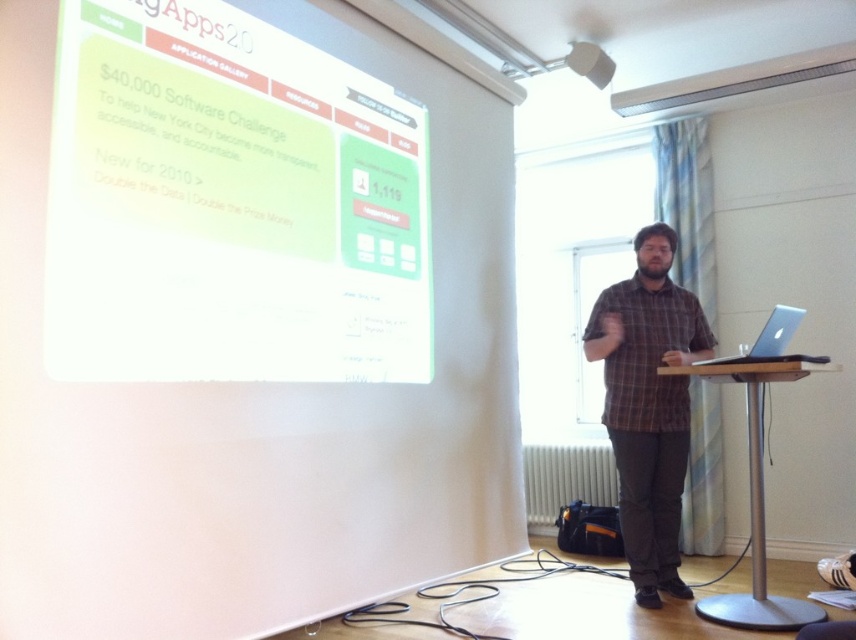
Question: Is white glossy projection screen at upper left wider than matte black shirt at center?

Choices:
 (A) yes
 (B) no

Answer: (A)

Question: Which is nearer to the brown plaid shirt at center?

Choices:
 (A) white glossy projection screen at upper left
 (B) silver metallic laptop at right

Answer: (B)

Question: Which point appears farthest from the camera in this image?

Choices:
 (A) (571, 68)
 (B) (750, 360)

Answer: (A)

Question: Where is silver metallic podium at center located in relation to matte black shirt at center in the image?

Choices:
 (A) right
 (B) left

Answer: (A)

Question: In this image, where is white glossy projection screen at upper left located relative to silver metallic laptop at right?

Choices:
 (A) above
 (B) below

Answer: (A)

Question: Which of the following is the farthest from the observer?

Choices:
 (A) (569, 64)
 (B) (168, 307)
 (C) (792, 307)
 (D) (758, 532)

Answer: (C)